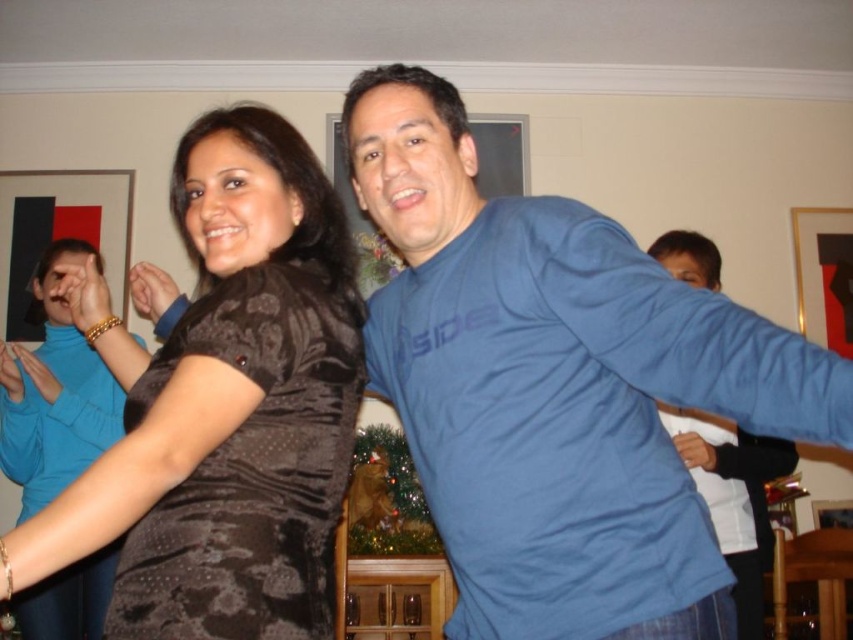
Does point (494, 328) come closer to viewer compared to point (693, 448)?

Yes, point (494, 328) is in front of point (693, 448).

Is blue cotton shirt at center further to the viewer compared to blue cotton shirt at right?

No, it is not.

Does point (630, 536) lie behind point (662, 408)?

No, (630, 536) is closer to viewer.

The height and width of the screenshot is (640, 853). In order to click on blue cotton shirt at center in this screenshot , I will do `click(556, 387)`.

Is point (303, 470) closer to camera compared to point (720, 442)?

Yes, it is in front of point (720, 442).

Is velvet brown dress at left further to camera compared to blue cotton shirt at right?

That is False.

Which is behind, point (225, 625) or point (788, 448)?

Point (788, 448)

Locate an element on the screen. The width and height of the screenshot is (853, 640). velvet brown dress at left is located at coordinates (250, 467).

Can you confirm if blue cotton shirt at center is positioned to the left of matte black dress at center?

No, blue cotton shirt at center is not to the left of matte black dress at center.

Between blue cotton shirt at center and matte black dress at center, which one is positioned higher?

blue cotton shirt at center is higher up.

Who is more forward, (567,349) or (44,356)?

Positioned in front is point (567,349).

Image resolution: width=853 pixels, height=640 pixels. I want to click on blue cotton shirt at center, so click(x=556, y=387).